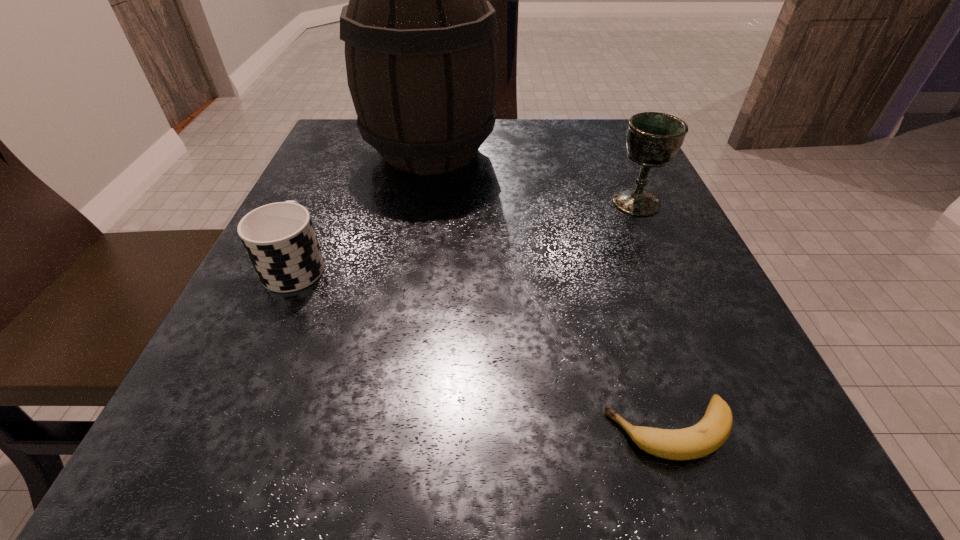
In order to click on free space located on the side of the third tallest object with the handle in this screenshot , I will do `click(347, 152)`.

Find the location of a particular element. Image resolution: width=960 pixels, height=540 pixels. vacant space situated 0.200m on the side of the third tallest object with the handle is located at coordinates (335, 176).

The height and width of the screenshot is (540, 960). I want to click on vacant space located on the side of the third tallest object with the handle, so click(346, 154).

Where is `free location located 0.200m on the back of the banana`? free location located 0.200m on the back of the banana is located at coordinates (621, 282).

The width and height of the screenshot is (960, 540). I want to click on object located at the far edge, so click(x=421, y=58).

Where is `object that is positioned at the near edge`? The image size is (960, 540). object that is positioned at the near edge is located at coordinates (710, 433).

At what (x,y) coordinates should I click in order to perform the action: click on wine bucket situated at the left edge. Please return your answer as a coordinate pair (x, y). Image resolution: width=960 pixels, height=540 pixels. Looking at the image, I should click on coord(421,58).

Where is `cup that is positioned at the left edge`? The height and width of the screenshot is (540, 960). cup that is positioned at the left edge is located at coordinates (279, 238).

Locate an element on the screen. chalice located in the right edge section of the desktop is located at coordinates (652, 139).

In order to click on banana located in the right edge section of the desktop in this screenshot , I will do `click(710, 433)`.